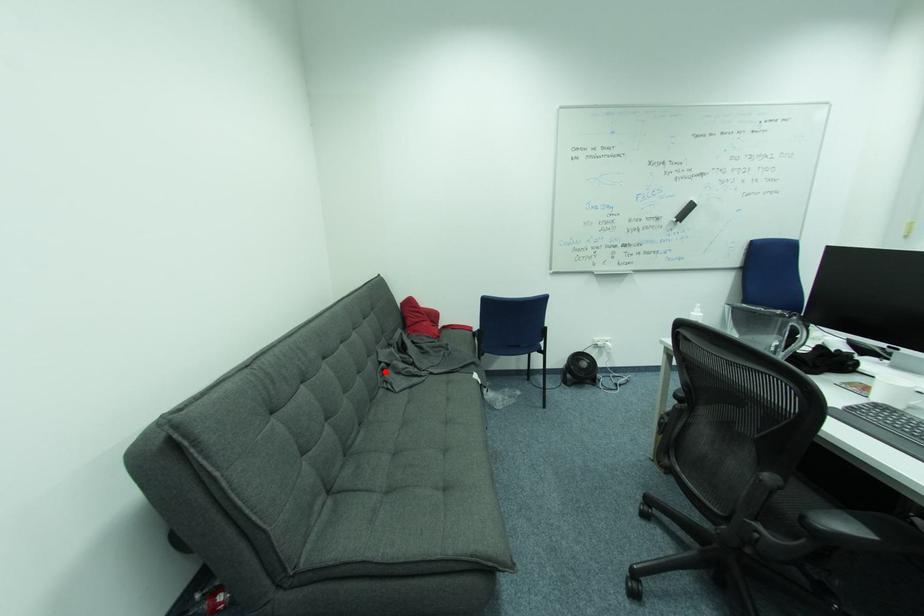
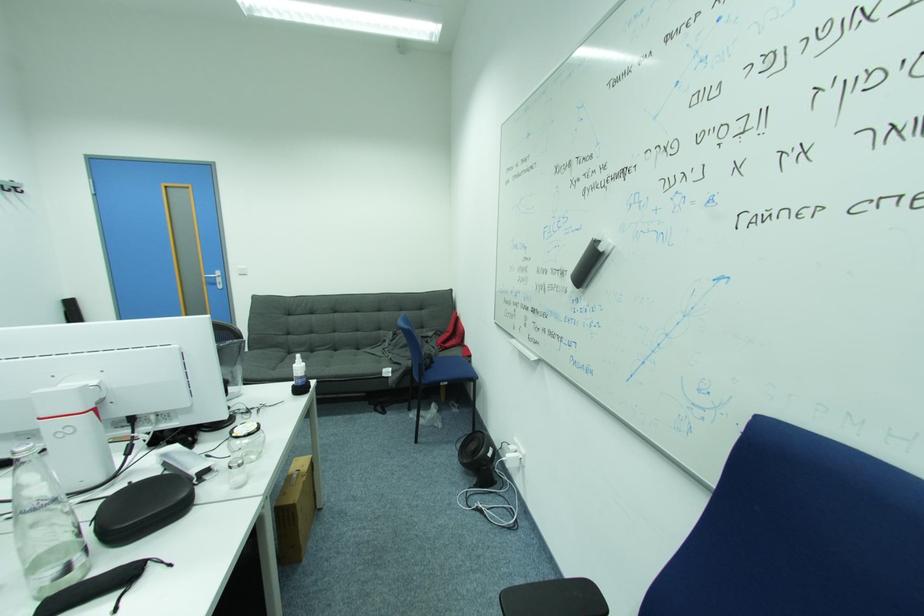
Locate, in the second image, the point that corresponds to the highlighted location in the first image.

(388, 341)